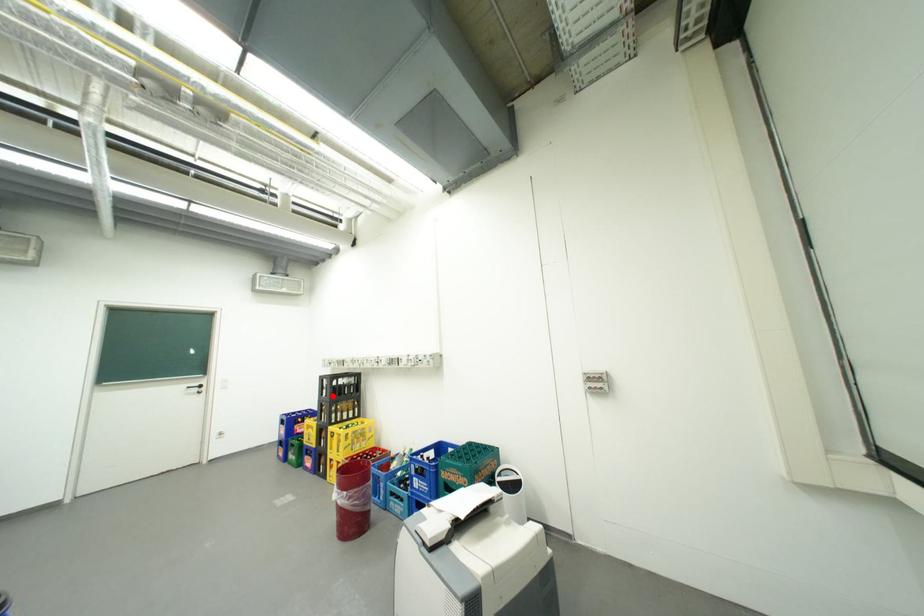
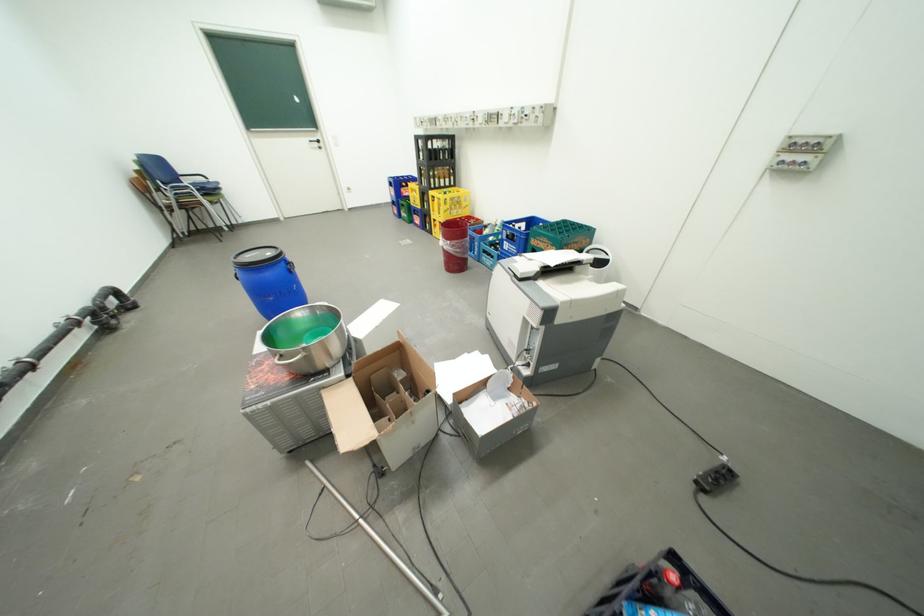
Question: I am providing you with two images of the same scene from different viewpoints. Image1 has a red point marked. In image2, the corresponding 3D location appears at what relative position? Reply with the corresponding letter.

Choices:
 (A) Closer
 (B) Farther

Answer: (A)